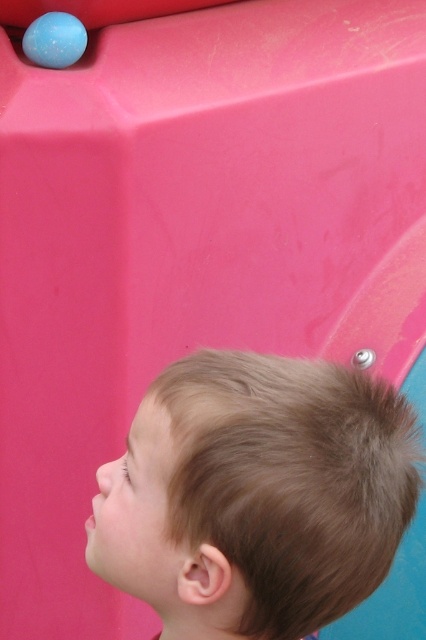
You are a photographer taking a picture of the brown hair at upper right and the matte blue ball at upper left. Which object appears larger in the photo?

The brown hair at upper right appears larger in the photo because it is bigger than the matte blue ball at upper left.

In the scene shown: You are a photographer trying to capture the child and the blue ball in the frame. Since the brown hair at upper right and the matte blue ball at upper left are both in the scene, which one would you need to adjust your focus on first if you want to ensure both are in focus, considering their sizes?

The brown hair at upper right is larger in width than the matte blue ball at upper left, so you should focus on the brown hair at upper right first to ensure both fit within the depth of field.

You are a photographer trying to capture a photo of both the brown hair at upper right and the matte blue ball at upper left in the same frame. Based on their distance, will you need to zoom in or zoom out to include both objects?

The brown hair at upper right and the matte blue ball at upper left are 1.04 meters apart from each other. To include both objects in the same frame, you would need to zoom out to capture the distance between them.